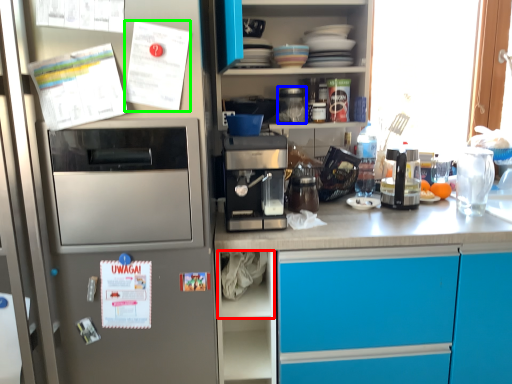
Question: Based on their relative distances, which object is nearer to shelf (highlighted by a red box)? Choose from appliance (highlighted by a blue box) and postcard (highlighted by a green box).

Choices:
 (A) appliance
 (B) postcard

Answer: (A)